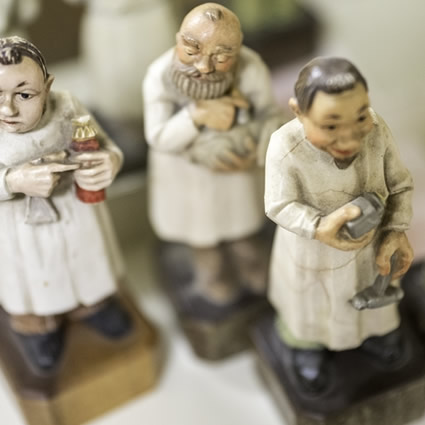
In order to click on stands in this screenshot , I will do `click(189, 322)`, `click(126, 362)`.